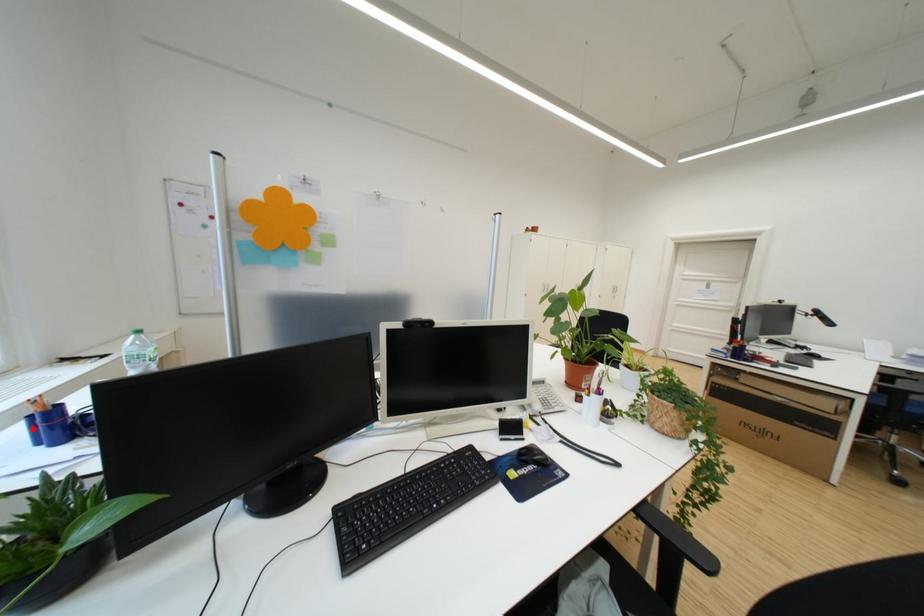
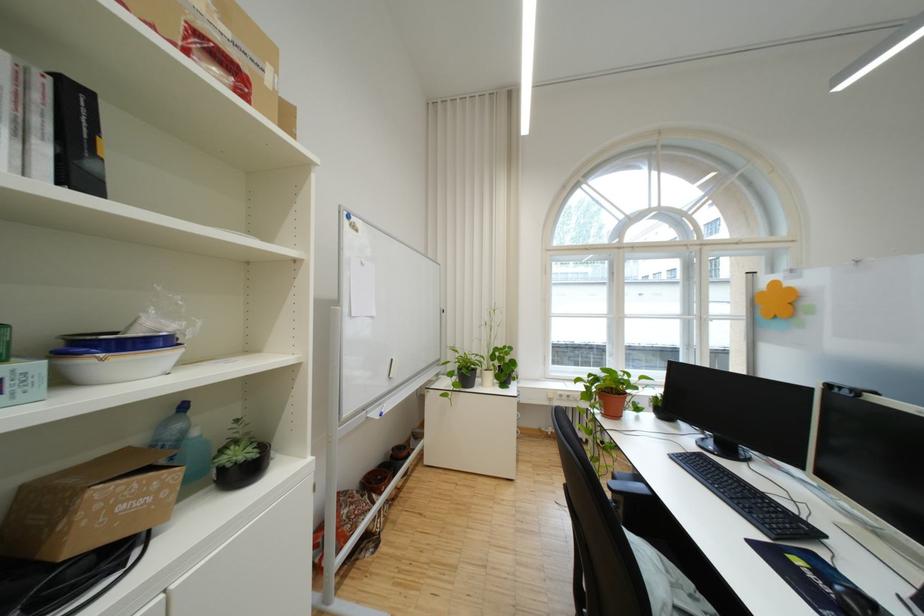
Question: I am providing you with two images of the same scene from different viewpoints. A red point is marked on the first image. Is the red point's position out of view in image 2?

Choices:
 (A) Yes
 (B) No

Answer: (A)